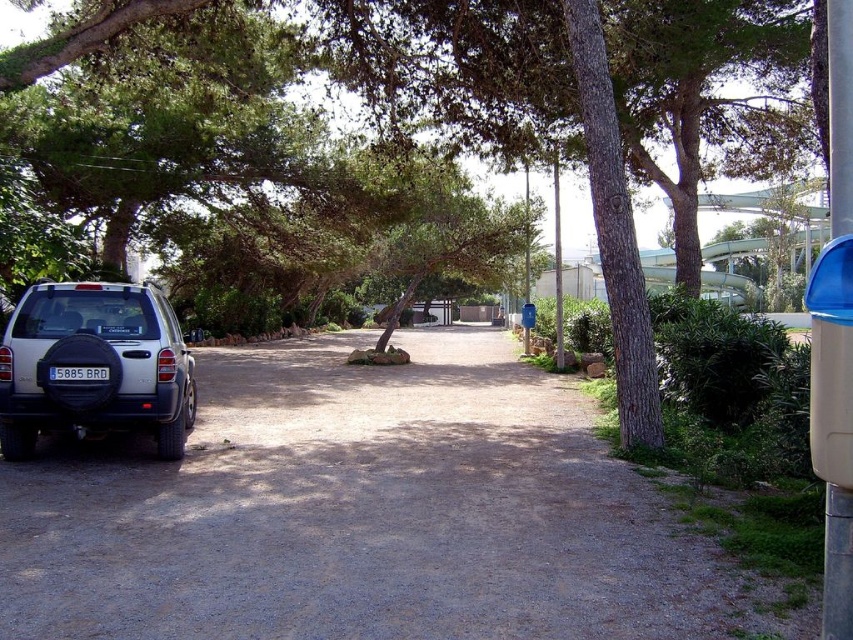
Question: Which point is farther from the camera taking this photo?

Choices:
 (A) (523, 19)
 (B) (56, 374)
 (C) (308, 481)
 (D) (21, 440)

Answer: (A)

Question: Which is nearer to the satin silver suv at lower left?

Choices:
 (A) green leafy tree at center
 (B) gray asphalt driveway at lower left

Answer: (B)

Question: Is green leafy tree at center smaller than satin silver suv at lower left?

Choices:
 (A) no
 (B) yes

Answer: (A)

Question: Can you confirm if gray asphalt driveway at lower left is positioned below green leafy tree at center?

Choices:
 (A) no
 (B) yes

Answer: (B)

Question: Does green leafy tree at center appear on the left side of blue matte license plate at lower left?

Choices:
 (A) no
 (B) yes

Answer: (A)

Question: Which point is farther from the camera taking this photo?

Choices:
 (A) (53, 372)
 (B) (44, 54)

Answer: (B)